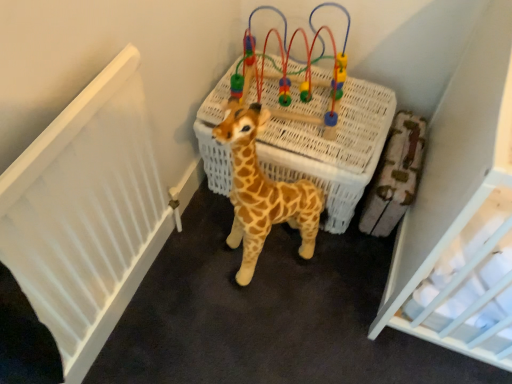
Locate an element on the screen. This screenshot has height=384, width=512. vacant space in between spotted plush giraffe at center and white wicker basket at center is located at coordinates (232, 220).